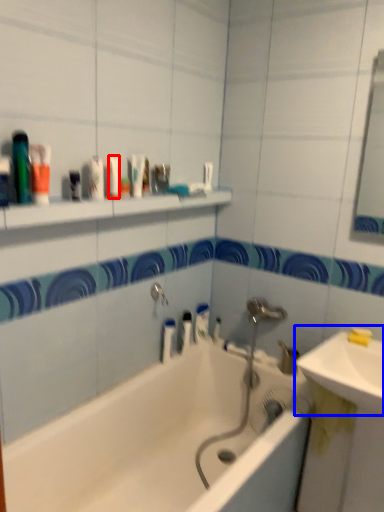
Question: Among these objects, which one is nearest to the camera, mouthwash (highlighted by a red box) or sink (highlighted by a blue box)?

Choices:
 (A) mouthwash
 (B) sink

Answer: (B)